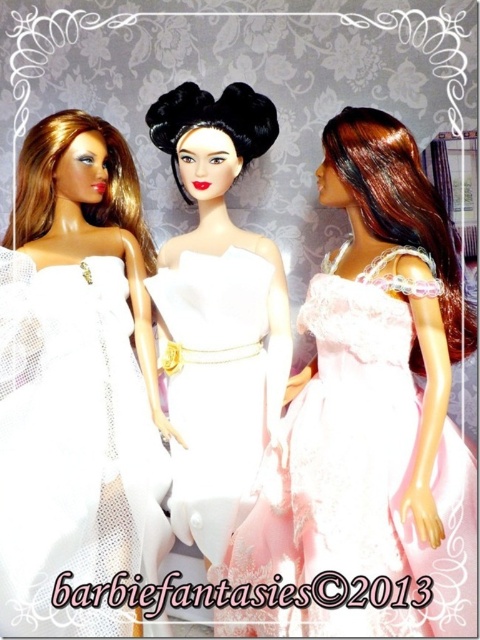
Question: From the image, what is the correct spatial relationship of pink lace dress at center in relation to white mesh dress at center?

Choices:
 (A) left
 (B) right

Answer: (B)

Question: Is white mesh dress at center further to camera compared to white satin dress at center?

Choices:
 (A) yes
 (B) no

Answer: (B)

Question: Can you confirm if white mesh dress at center is wider than white satin dress at center?

Choices:
 (A) no
 (B) yes

Answer: (B)

Question: Which is farther from the white mesh dress at center?

Choices:
 (A) pink lace dress at center
 (B) white satin dress at center

Answer: (A)

Question: Which point is closer to the camera taking this photo?

Choices:
 (A) (397, 620)
 (B) (162, 536)
 (C) (219, 481)

Answer: (A)

Question: Which object is farther from the camera taking this photo?

Choices:
 (A) white satin dress at center
 (B) white mesh dress at center

Answer: (A)